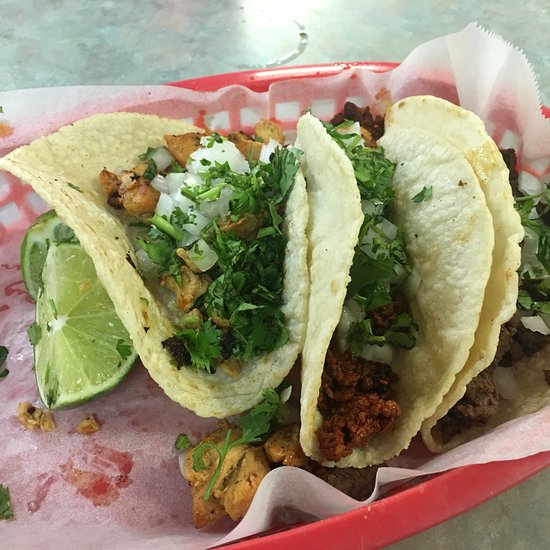
You are a GUI agent. You are given a task and a screenshot of the screen. Output one action in this format:
    pyautogui.click(x=<x>, y=<y>)
    Task: Click on the red basket tray
    This screenshot has width=550, height=550.
    Given the screenshot: What is the action you would take?
    pyautogui.click(x=388, y=517)